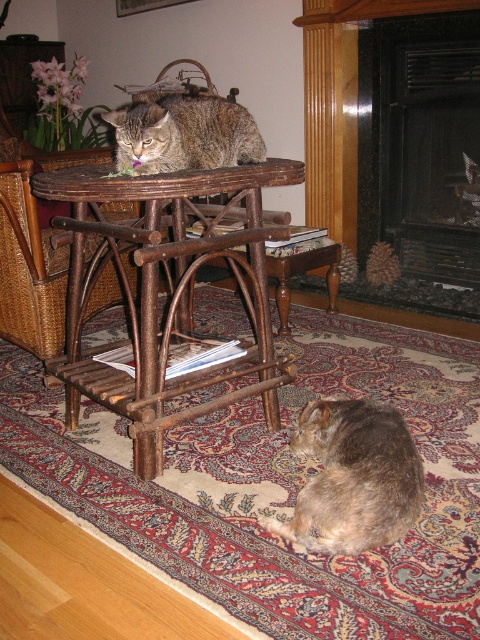
Question: Which of the following is the closest to the observer?

Choices:
 (A) (169, 392)
 (B) (411, 96)
 (C) (196, 152)
 (D) (398, 500)

Answer: (D)

Question: Does black marble fireplace at upper right have a lesser width compared to brown wood table at center?

Choices:
 (A) yes
 (B) no

Answer: (A)

Question: Which object appears closest to the camera in this image?

Choices:
 (A) black marble fireplace at upper right
 (B) brown shaggy cat at lower center

Answer: (B)

Question: Which of the following is the closest to the observer?

Choices:
 (A) black marble fireplace at upper right
 (B) tabby fur cat at center
 (C) brown shaggy cat at lower center
 (D) brown wood table at center

Answer: (C)

Question: Does black marble fireplace at upper right appear on the left side of brown shaggy cat at lower center?

Choices:
 (A) no
 (B) yes

Answer: (A)

Question: Is brown wood table at center bigger than brown shaggy cat at lower center?

Choices:
 (A) yes
 (B) no

Answer: (A)